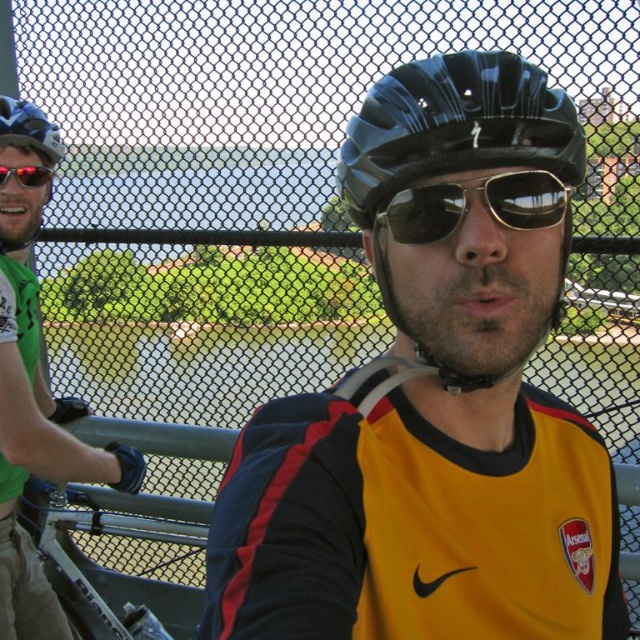
Is matte black helmet at upper left to the left of shiny reflective sunglasses at upper left from the viewer's perspective?

In fact, matte black helmet at upper left is to the right of shiny reflective sunglasses at upper left.

Can you confirm if matte black helmet at upper left is positioned to the right of shiny reflective sunglasses at upper left?

Yes, matte black helmet at upper left is to the right of shiny reflective sunglasses at upper left.

Is point (36, 132) more distant than point (33, 184)?

That is False.

At what (x,y) coordinates should I click in order to perform the action: click on matte black helmet at upper left. Please return your answer as a coordinate pair (x, y). The image size is (640, 640). Looking at the image, I should click on (29, 129).

Is glossy black helmet at center closer to the viewer compared to matte black helmet at upper left?

Yes.

Is point (435, 161) closer to viewer compared to point (40, 147)?

Yes.

Who is more forward, (554, 308) or (33, 140)?

Point (554, 308) is more forward.

Locate an element on the screen. glossy black helmet at center is located at coordinates (451, 147).

Is glossy black helmet at center thinner than green matte helmet at left?

No.

Does glossy black helmet at center appear on the right side of green matte helmet at left?

Correct, you'll find glossy black helmet at center to the right of green matte helmet at left.

Is point (493, 77) more distant than point (10, 246)?

No, (493, 77) is in front of (10, 246).

The height and width of the screenshot is (640, 640). I want to click on glossy black helmet at center, so click(x=451, y=147).